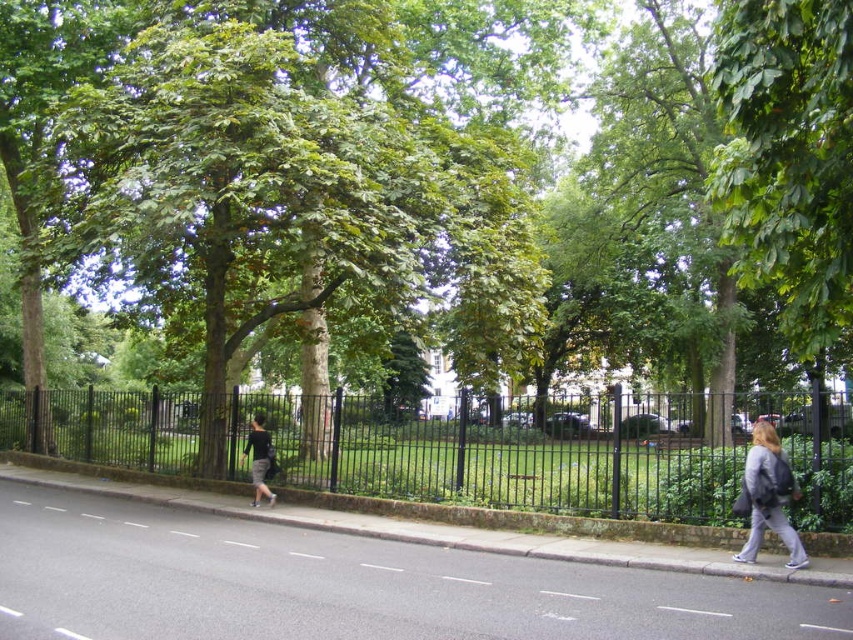
Question: Is gray fabric jacket at lower right wider than dark gray fabric pants at center?

Choices:
 (A) yes
 (B) no

Answer: (A)

Question: Observing the image, what is the correct spatial positioning of black metal fence at center in reference to dark gray fabric pants at center?

Choices:
 (A) left
 (B) right

Answer: (B)

Question: Among these points, which one is nearest to the camera?

Choices:
 (A) (784, 536)
 (B) (607, 504)

Answer: (A)

Question: Which point is closer to the camera?

Choices:
 (A) (134, 465)
 (B) (764, 444)
 (C) (260, 493)

Answer: (B)

Question: Considering the relative positions of black metal fence at center and gray fabric jacket at lower right in the image provided, where is black metal fence at center located with respect to gray fabric jacket at lower right?

Choices:
 (A) above
 (B) below

Answer: (B)

Question: Which object is closer to the camera taking this photo?

Choices:
 (A) green leafy tree at center
 (B) gray fabric jacket at lower right

Answer: (A)